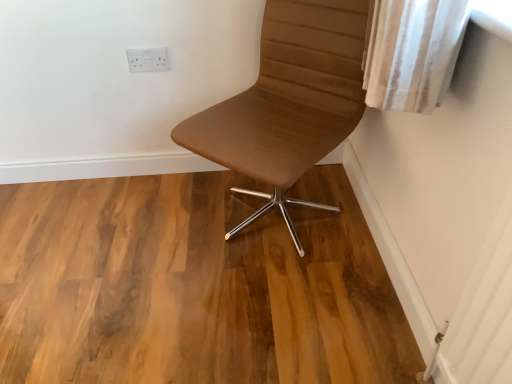
You are a GUI agent. You are given a task and a screenshot of the screen. Output one action in this format:
    pyautogui.click(x=<x>, y=<y>)
    Task: Click on the vacant space underneath brown leather chair at center (from a real-world perspective)
    This screenshot has height=384, width=512.
    Given the screenshot: What is the action you would take?
    pyautogui.click(x=274, y=213)